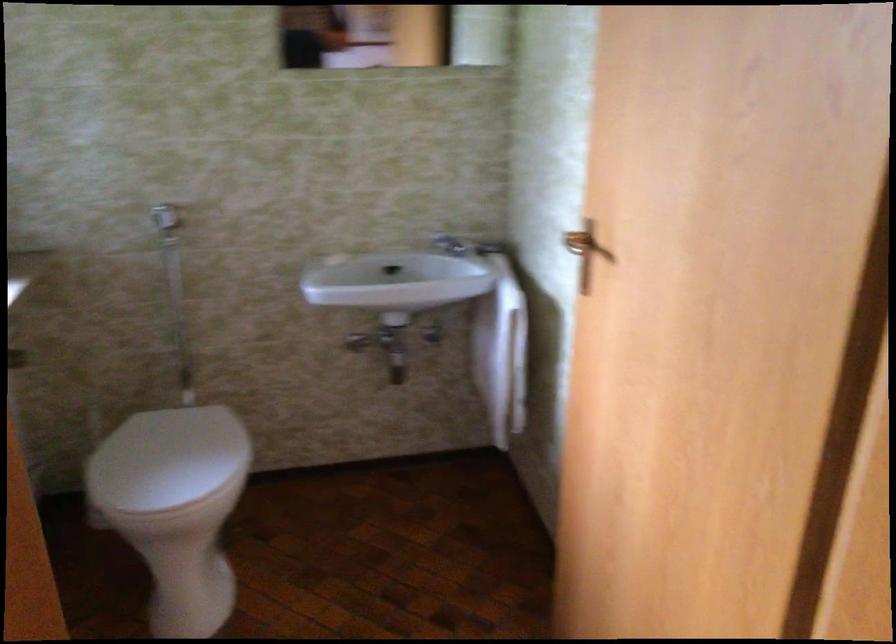
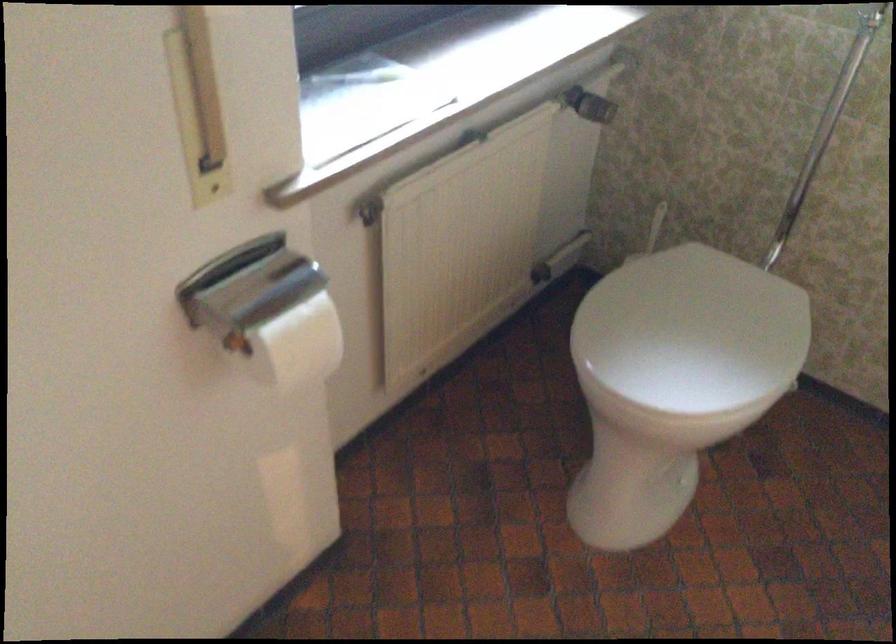
Based on the continuous images, in which direction is the camera rotating?

The rotation direction of the camera is left-down.